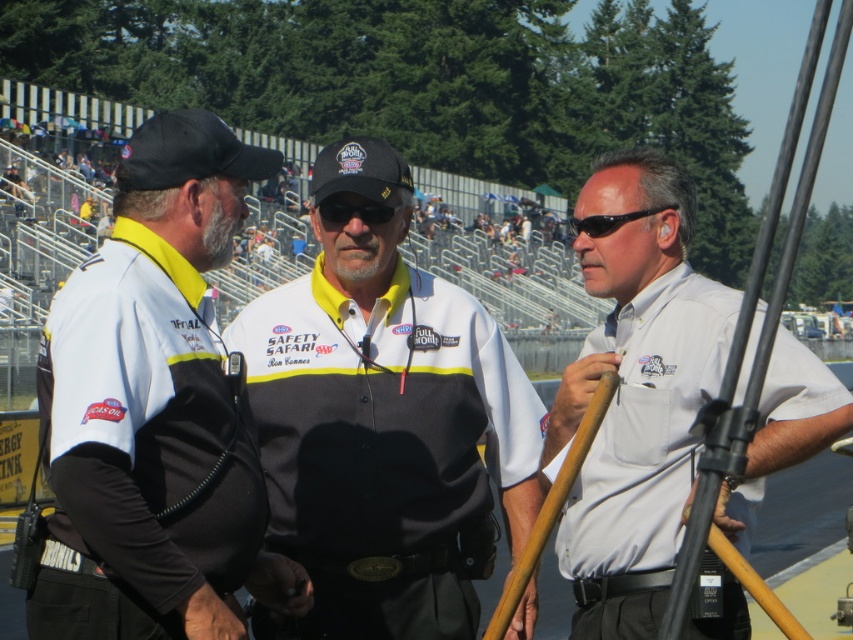
Looking at this image, you are a photographer positioned at the back of the scene. You need to capture a clear photo of both the white matte shirt at center and the black plastic sunglasses at center. Which object will appear larger in your photo?

The white matte shirt at center will appear larger in the photo because it is closer to the viewer than the black plastic sunglasses at center.

You are a photographer at the event and need to capture a closeup of both the white matte shirt at center and the black plastic sunglasses at center. Which object should you focus on first to ensure it appears larger in the photo?

The white matte shirt at center is not as tall as the black plastic sunglasses at center, so you should focus on the black plastic sunglasses at center first to ensure it appears larger in the photo.

From the picture: You are a photographer at the event and need to capture a clear shot of both the white fabric shirt at center and the black uniform at center. Which one is positioned lower in the frame?

The white fabric shirt at center is located below the black uniform at center, so it is positioned lower in the frame.